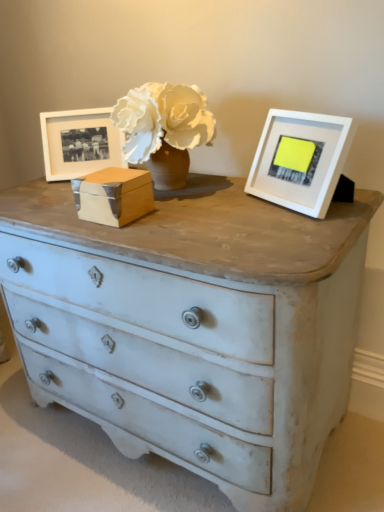
Question: In terms of width, does white matte picture frame at upper right, the first picture frame in the front-to-back sequence, look wider or thinner when compared to wooden box at center?

Choices:
 (A) wide
 (B) thin

Answer: (B)

Question: Is white matte picture frame at upper right, which is the second picture frame from back to front, in front of or behind wooden box at center in the image?

Choices:
 (A) front
 (B) behind

Answer: (A)

Question: Which of these objects is positioned farthest from the matte white picture frame at left, marked as the 2th picture frame in a right-to-left arrangement?

Choices:
 (A) white matte picture frame at upper right, the second picture frame viewed from the left
 (B) wooden box at center

Answer: (A)

Question: Which object is positioned closest to the matte white picture frame at left, marked as the 2th picture frame in a right-to-left arrangement?

Choices:
 (A) white matte picture frame at upper right, the 1th picture frame from the right
 (B) wooden box at center

Answer: (B)